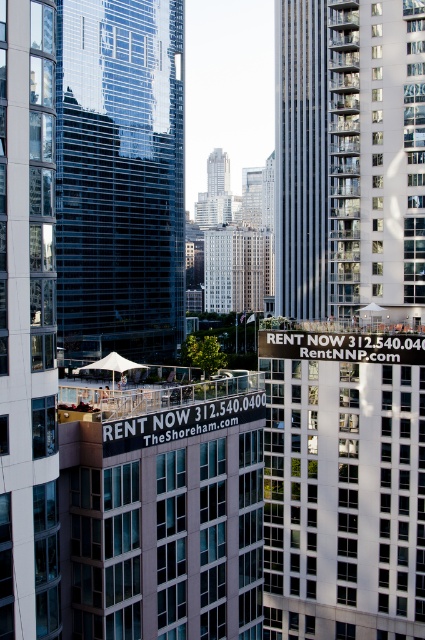
Question: Estimate the real-world distances between objects in this image. Which object is farther from the white glass building at right?

Choices:
 (A) transparent glass building at center
 (B) smooth gray skyscraper at center

Answer: (A)

Question: Among these objects, which one is farthest from the camera?

Choices:
 (A) smooth gray skyscraper at center
 (B) transparent glass building at center

Answer: (A)

Question: Which object is closer to the camera taking this photo?

Choices:
 (A) transparent glass building at center
 (B) smooth gray skyscraper at center

Answer: (A)

Question: Is the position of white glass building at right more distant than that of smooth gray skyscraper at center?

Choices:
 (A) no
 (B) yes

Answer: (A)

Question: From the image, what is the correct spatial relationship of white glass building at right in relation to smooth gray skyscraper at center?

Choices:
 (A) above
 (B) below

Answer: (B)

Question: Does white glass building at right have a greater width compared to smooth gray skyscraper at center?

Choices:
 (A) no
 (B) yes

Answer: (B)